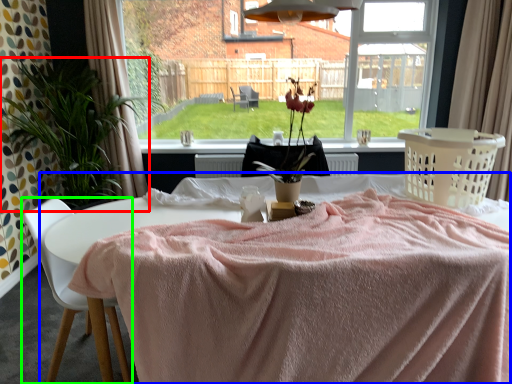
Question: Estimate the real-world distances between objects in this image. Which object is closer to houseplant (highlighted by a red box), table (highlighted by a blue box) or chair (highlighted by a green box)?

Choices:
 (A) table
 (B) chair

Answer: (B)